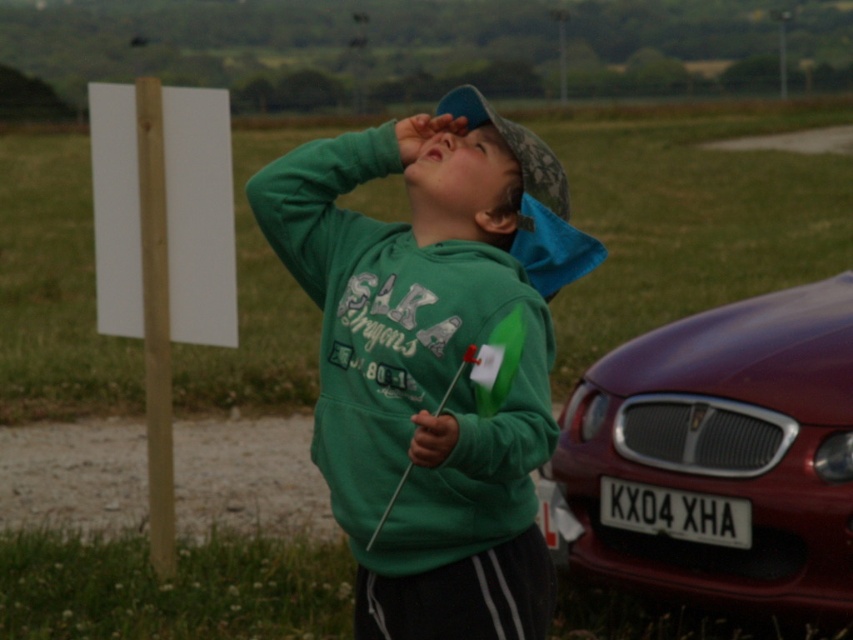
The boy is wearing a green cotton hoodie at center and has a blue glossy eye at upper center. Which object is positioned to the right side?

The green cotton hoodie at center is positioned to the right of the blue glossy eye at upper center.

The user is planning to hang a small birdhouse on the light brown wooden pole at left. They want the birdhouse to be at the same height as the green cotton hoodie at center. Is this possible?

The light brown wooden pole at left is located below the green cotton hoodie at center, so the birdhouse can be hung at the height of the green cotton hoodie at center since the pole extends upward to that level.